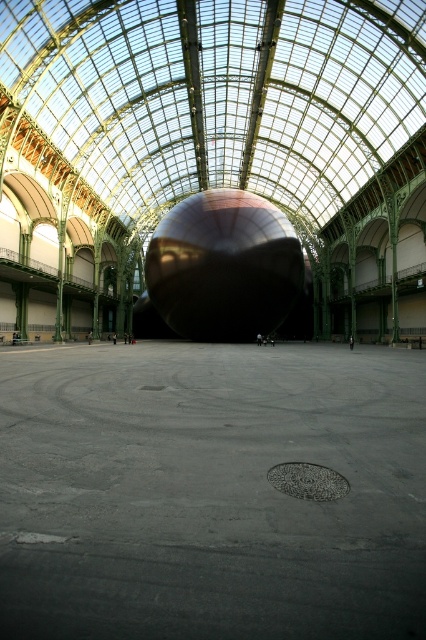
Question: Is metallic sphere at center positioned before shiny metallic sphere at center?

Choices:
 (A) no
 (B) yes

Answer: (B)

Question: Can you confirm if metallic sphere at center is positioned below shiny metallic sphere at center?

Choices:
 (A) no
 (B) yes

Answer: (B)

Question: Among these objects, which one is nearest to the camera?

Choices:
 (A) metallic sphere at center
 (B) shiny metallic sphere at center

Answer: (A)

Question: Among these objects, which one is nearest to the camera?

Choices:
 (A) metallic sphere at center
 (B) shiny metallic sphere at center

Answer: (A)

Question: Does metallic sphere at center appear on the right side of shiny metallic sphere at center?

Choices:
 (A) no
 (B) yes

Answer: (A)